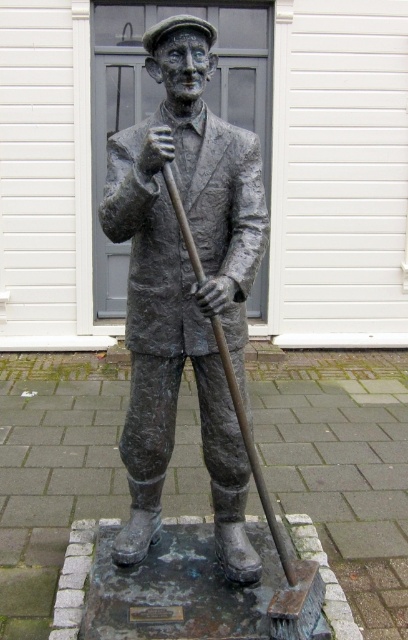
You are an artist planning to sketch the scene. You notice both the bronze statue at center and the shiny metal shovel at center. Which object should you draw first if you want to capture the larger object first?

The bronze statue at center is bigger than the shiny metal shovel at center, so you should draw the bronze statue at center first.

Based on the photo, you are standing in front of the bronze statue of a man holding a broom and a walking stick. You notice two points marked on the statue. The first point is at coordinate point (241, 248) and the second is at point (170, 170). If you were to reach out and touch both points with your hands, which point would require you to extend your arm less?

Point (170, 170) is closer to you than point (241, 248), so you would need to extend your arm less to touch point (170, 170).

You are a tour guide explaining the statue to visitors. You point out the bronze statue at center and the shiny metal shovel at center. Which object is positioned higher in the image?

The bronze statue at center is positioned higher than the shiny metal shovel at center according to the description.